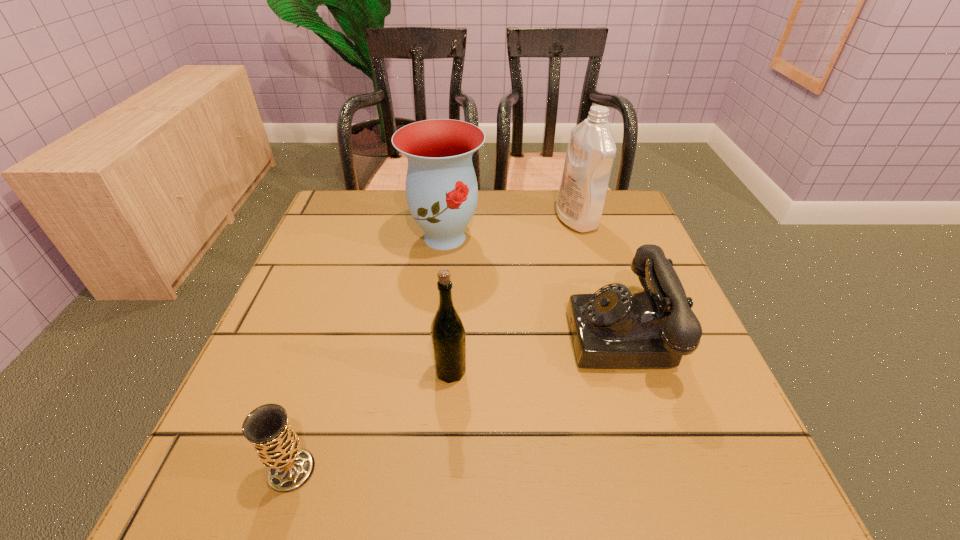
Image resolution: width=960 pixels, height=540 pixels. I want to click on detergent, so tap(591, 150).

Image resolution: width=960 pixels, height=540 pixels. In order to click on vase in this screenshot , I will do `click(441, 187)`.

This screenshot has width=960, height=540. Find the location of `beer bottle`. beer bottle is located at coordinates (448, 336).

The height and width of the screenshot is (540, 960). In order to click on the fourth tallest object in this screenshot , I will do `click(613, 328)`.

Locate an element on the screen. the shortest object is located at coordinates (277, 445).

This screenshot has width=960, height=540. In order to click on chalice in this screenshot , I will do `click(277, 445)`.

The image size is (960, 540). Identify the location of free space located 0.260m on the left of the detergent. (456, 220).

The height and width of the screenshot is (540, 960). Find the location of `free spot located 0.170m on the front of the vase`. free spot located 0.170m on the front of the vase is located at coordinates (437, 315).

You are a GUI agent. You are given a task and a screenshot of the screen. Output one action in this format:
    pyautogui.click(x=<x>, y=<y>)
    Task: Click on the vacant region located on the front of the beer bottle
    
    Given the screenshot: What is the action you would take?
    pyautogui.click(x=444, y=464)

Where is `vacant space located 0.050m on the dial of the second shortest object`? vacant space located 0.050m on the dial of the second shortest object is located at coordinates (543, 333).